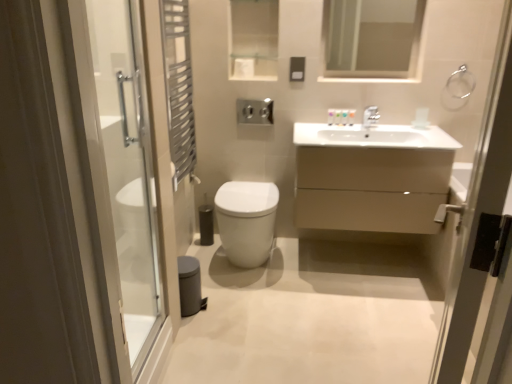
You are a GUI agent. You are given a task and a screenshot of the screen. Output one action in this format:
    pyautogui.click(x=<x>, y=<y>)
    Task: Click on the free space in front of satin nickel faucet at upper center
    The height and width of the screenshot is (384, 512).
    Given the screenshot: What is the action you would take?
    pyautogui.click(x=377, y=136)